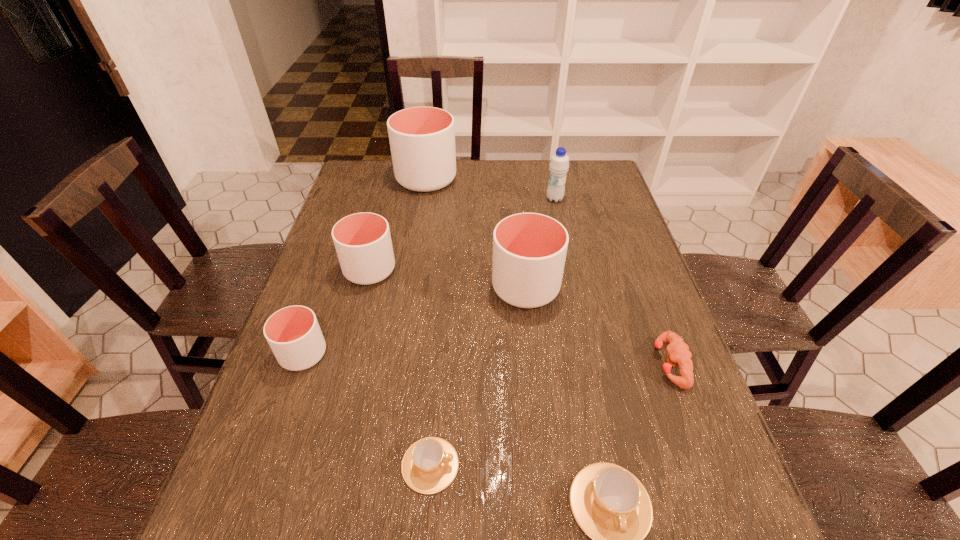
The image size is (960, 540). Identify the location of the rightmost object. (678, 352).

At what (x,y) coordinates should I click in order to perform the action: click on the shortest cup. Please return your answer as a coordinate pair (x, y). This screenshot has height=540, width=960. Looking at the image, I should click on (430, 464).

The height and width of the screenshot is (540, 960). Identify the location of the smaller brown cup. (430, 464).

I want to click on vacant point located 0.200m on the front of the farthest cup, so pyautogui.click(x=418, y=233).

Identify the location of vacant region located 0.210m on the front of the water bottle. The height and width of the screenshot is (540, 960). (564, 245).

Find the location of a particular element. The height and width of the screenshot is (540, 960). free space located 0.090m on the back of the rightmost white cup is located at coordinates (521, 244).

I want to click on vacant space located on the right of the fifth shortest object, so click(x=496, y=270).

You are a GUI agent. You are given a task and a screenshot of the screen. Output one action in this format:
    pyautogui.click(x=<x>, y=<y>)
    Task: Click on the vacant space located on the right of the nearest white cup
    Image resolution: width=960 pixels, height=540 pixels.
    Given the screenshot: What is the action you would take?
    (x=500, y=354)

This screenshot has width=960, height=540. I want to click on vacant area situated 0.400m with the gloves of the puncher facing forward, so click(x=478, y=363).

You are a GUI agent. You are given a task and a screenshot of the screen. Output one action in this format:
    pyautogui.click(x=<x>, y=<y>)
    Task: Click on the vacant space situated 0.280m with the gloves of the puncher facing forward
    
    Given the screenshot: What is the action you would take?
    pyautogui.click(x=531, y=363)